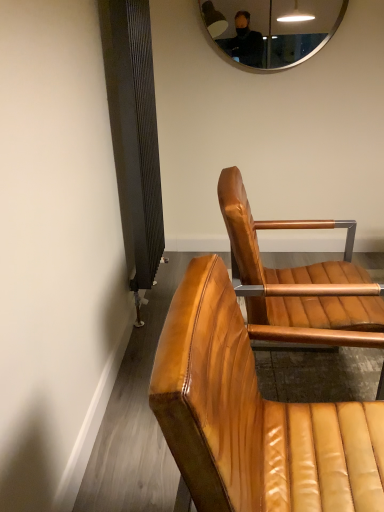
Question: From a real-world perspective, is silver metallic mirror at upper center below shiny brown leather chair at center, the first chair when ordered from back to front?

Choices:
 (A) yes
 (B) no

Answer: (B)

Question: From the image's perspective, is silver metallic mirror at upper center located above shiny brown leather chair at center, the first chair when ordered from back to front?

Choices:
 (A) no
 (B) yes

Answer: (B)

Question: Is shiny brown leather chair at center, marked as the second chair in a front-to-back arrangement, at the back of silver metallic mirror at upper center?

Choices:
 (A) no
 (B) yes

Answer: (A)

Question: Is silver metallic mirror at upper center with shiny brown leather chair at center, the first chair when ordered from back to front?

Choices:
 (A) no
 (B) yes

Answer: (A)

Question: Can you confirm if silver metallic mirror at upper center is positioned to the right of shiny brown leather chair at center, the first chair when ordered from back to front?

Choices:
 (A) yes
 (B) no

Answer: (A)

Question: Is silver metallic mirror at upper center taller than shiny brown leather chair at center, the first chair when ordered from back to front?

Choices:
 (A) yes
 (B) no

Answer: (B)

Question: From the image's perspective, would you say shiny brown leather chair at center, marked as the second chair in a front-to-back arrangement, is shown under silver metallic mirror at upper center?

Choices:
 (A) no
 (B) yes

Answer: (B)

Question: Is shiny brown leather chair at center, marked as the second chair in a front-to-back arrangement, next to silver metallic mirror at upper center and touching it?

Choices:
 (A) no
 (B) yes

Answer: (A)

Question: Can you confirm if shiny brown leather chair at center, the first chair when ordered from back to front, is bigger than silver metallic mirror at upper center?

Choices:
 (A) no
 (B) yes

Answer: (B)

Question: Is silver metallic mirror at upper center at the back of shiny brown leather chair at center, marked as the second chair in a front-to-back arrangement?

Choices:
 (A) yes
 (B) no

Answer: (B)

Question: Is shiny brown leather chair at center, the first chair when ordered from back to front, to the right of silver metallic mirror at upper center from the viewer's perspective?

Choices:
 (A) no
 (B) yes

Answer: (A)

Question: Is shiny brown leather chair at center, marked as the second chair in a front-to-back arrangement, not within silver metallic mirror at upper center?

Choices:
 (A) yes
 (B) no

Answer: (A)

Question: Would you say shiny brown leather chair at center, the first chair when ordered from back to front, contains leather chair at center, which is the second chair from back to front?

Choices:
 (A) no
 (B) yes

Answer: (A)